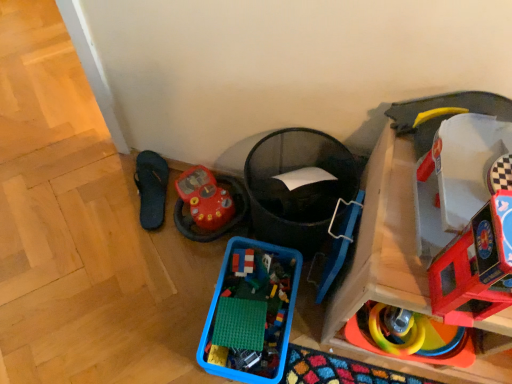
Question: Can you confirm if black rubber flip-flop at lower left is smaller than rubberized plastic toy car at lower left, which is the first toy in left-to-right order?

Choices:
 (A) no
 (B) yes

Answer: (B)

Question: Does black rubber flip-flop at lower left have a lesser height compared to rubberized plastic toy car at lower left, positioned as the 6th toy in right-to-left order?

Choices:
 (A) yes
 (B) no

Answer: (A)

Question: Could rubberized plastic toy car at lower left, positioned as the 6th toy in right-to-left order, be considered to be inside black rubber flip-flop at lower left?

Choices:
 (A) yes
 (B) no

Answer: (B)

Question: From the image's perspective, is black rubber flip-flop at lower left located beneath rubberized plastic toy car at lower left, which is the first toy in left-to-right order?

Choices:
 (A) yes
 (B) no

Answer: (B)

Question: Is black rubber flip-flop at lower left oriented away from rubberized plastic toy car at lower left, which is the first toy in left-to-right order?

Choices:
 (A) yes
 (B) no

Answer: (B)

Question: Does black rubber flip-flop at lower left appear on the right side of rubberized plastic toy car at lower left, which is the first toy in left-to-right order?

Choices:
 (A) yes
 (B) no

Answer: (B)

Question: Does blue plastic container at lower center, placed as the 4th toy when sorted from right to left, have a smaller size compared to rubberized plastic rings at lower right, marked as the 3th toy in a right-to-left arrangement?

Choices:
 (A) yes
 (B) no

Answer: (B)

Question: Does blue plastic container at lower center, placed as the 4th toy when sorted from right to left, have a lesser height compared to rubberized plastic rings at lower right, marked as the 3th toy in a right-to-left arrangement?

Choices:
 (A) no
 (B) yes

Answer: (A)

Question: Is blue plastic container at lower center, placed as the 4th toy when sorted from right to left, further to the viewer compared to rubberized plastic rings at lower right, marked as the fourth toy in a left-to-right arrangement?

Choices:
 (A) yes
 (B) no

Answer: (A)

Question: Is blue plastic container at lower center, placed as the 4th toy when sorted from right to left, thinner than rubberized plastic rings at lower right, marked as the fourth toy in a left-to-right arrangement?

Choices:
 (A) no
 (B) yes

Answer: (A)

Question: Is blue plastic container at lower center, placed as the 4th toy when sorted from right to left, not near rubberized plastic rings at lower right, marked as the fourth toy in a left-to-right arrangement?

Choices:
 (A) yes
 (B) no

Answer: (B)

Question: From a real-world perspective, is blue plastic container at lower center, placed as the 4th toy when sorted from right to left, over rubberized plastic rings at lower right, marked as the 3th toy in a right-to-left arrangement?

Choices:
 (A) no
 (B) yes

Answer: (A)

Question: Does smooth plastic toy car at right, arranged as the second toy when viewed from the right, lie behind translucent plastic bricks at center, which is counted as the fifth toy, starting from the right?

Choices:
 (A) yes
 (B) no

Answer: (B)